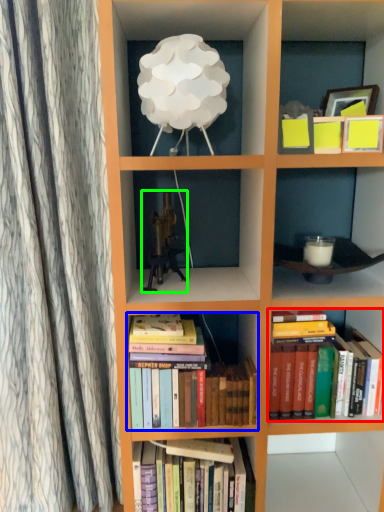
Question: Which object is positioned farthest from book (highlighted by a red box)? Select from book (highlighted by a blue box) and toy (highlighted by a green box).

Choices:
 (A) book
 (B) toy

Answer: (B)